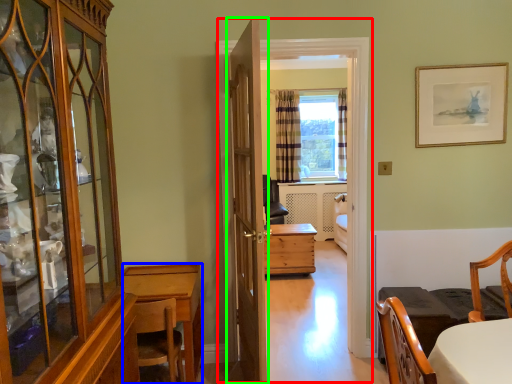
Question: Which object is positioned closest to corridor (highlighted by a red box)? Select from desk (highlighted by a blue box) and door (highlighted by a green box).

Choices:
 (A) desk
 (B) door

Answer: (B)